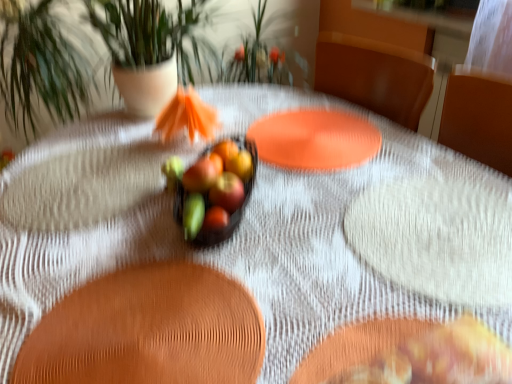
Identify the location of vacant space in front of glossy red apple at center, the second apple in the back-to-front sequence. (238, 278).